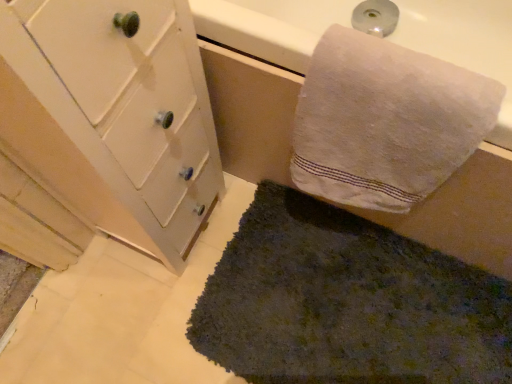
Question: Is dark green shaggy rug at lower center wider than white cotton towel at upper right?

Choices:
 (A) no
 (B) yes

Answer: (B)

Question: Is dark green shaggy rug at lower center located outside white cotton towel at upper right?

Choices:
 (A) yes
 (B) no

Answer: (A)

Question: Does dark green shaggy rug at lower center come behind white cotton towel at upper right?

Choices:
 (A) yes
 (B) no

Answer: (A)

Question: Considering the relative sizes of dark green shaggy rug at lower center and white cotton towel at upper right in the image provided, is dark green shaggy rug at lower center smaller than white cotton towel at upper right?

Choices:
 (A) no
 (B) yes

Answer: (A)

Question: From the image's perspective, would you say dark green shaggy rug at lower center is shown under white cotton towel at upper right?

Choices:
 (A) no
 (B) yes

Answer: (B)

Question: From their relative heights in the image, would you say white painted wood cabinet at left is taller or shorter than dark green shaggy rug at lower center?

Choices:
 (A) short
 (B) tall

Answer: (B)

Question: From a real-world perspective, is white painted wood cabinet at left positioned above or below dark green shaggy rug at lower center?

Choices:
 (A) above
 (B) below

Answer: (A)

Question: Which is correct: white painted wood cabinet at left is inside dark green shaggy rug at lower center, or outside of it?

Choices:
 (A) outside
 (B) inside

Answer: (A)

Question: Considering the positions of white painted wood cabinet at left and dark green shaggy rug at lower center in the image, is white painted wood cabinet at left wider or thinner than dark green shaggy rug at lower center?

Choices:
 (A) thin
 (B) wide

Answer: (A)

Question: Considering the positions of point (379, 253) and point (365, 167), is point (379, 253) closer or farther from the camera than point (365, 167)?

Choices:
 (A) closer
 (B) farther

Answer: (B)

Question: Considering their positions, is dark green shaggy rug at lower center located in front of or behind white cotton towel at upper right?

Choices:
 (A) front
 (B) behind

Answer: (B)

Question: Choose the correct answer: Is dark green shaggy rug at lower center inside white cotton towel at upper right or outside it?

Choices:
 (A) outside
 (B) inside

Answer: (A)

Question: From a real-world perspective, is dark green shaggy rug at lower center above or below white cotton towel at upper right?

Choices:
 (A) above
 (B) below

Answer: (B)

Question: Based on their sizes in the image, would you say white painted wood cabinet at left is bigger or smaller than white cotton towel at upper right?

Choices:
 (A) big
 (B) small

Answer: (A)

Question: Would you say white painted wood cabinet at left is inside or outside white cotton towel at upper right?

Choices:
 (A) outside
 (B) inside

Answer: (A)